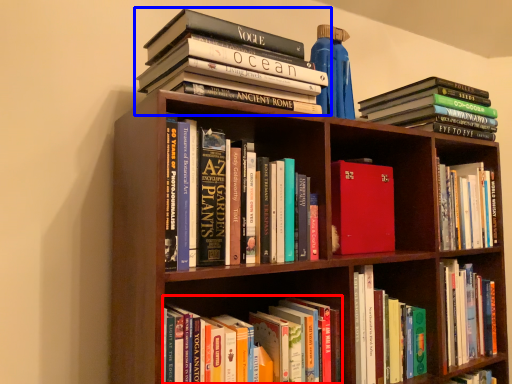
Question: Which of the following is the closest to the observer, book (highlighted by a red box) or book (highlighted by a blue box)?

Choices:
 (A) book
 (B) book

Answer: (A)